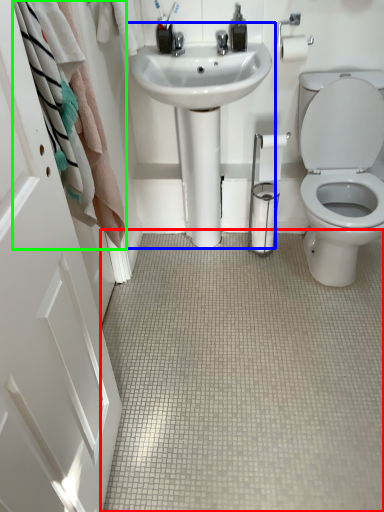
Question: Which is nearer to the plain (highlighted by a red box)? sink (highlighted by a blue box) or bath towel (highlighted by a green box).

Choices:
 (A) sink
 (B) bath towel

Answer: (A)